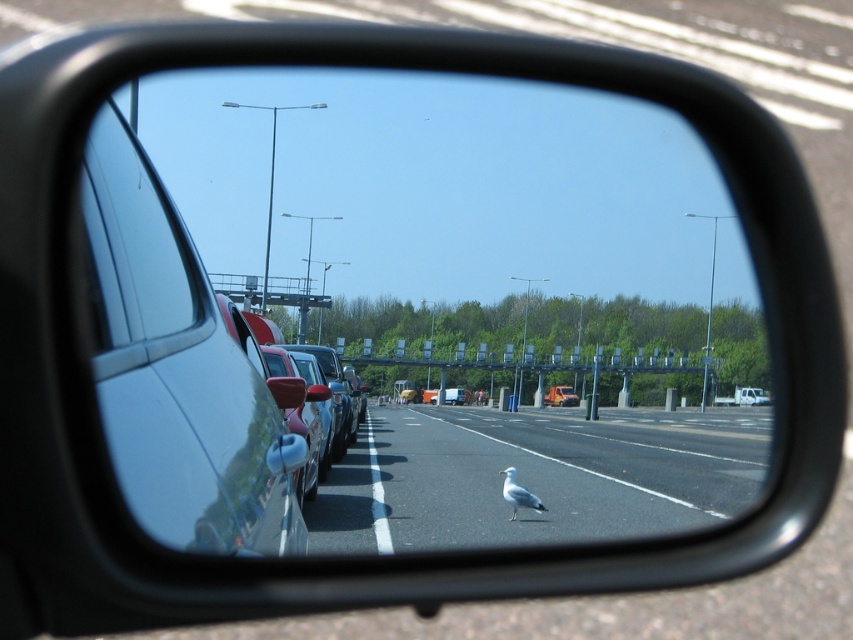
You are a driver checking your side mirror to see if you can safely change lanes. You notice two windows in the reflection of the side mirror. The glossy metallic car window at left and the clear glass car window at left. Which window is wider?

The glossy metallic car window at left is wider than the clear glass car window at left according to the description.

You are a passenger in a car and looking at the side mirror. You notice two windows on the left side of the mirror reflection. Which one is taller between the glossy metallic car window at left and the clear glass car window at left?

The glossy metallic car window at left is much taller than the clear glass car window at left according to the description.

You are driving and looking at the side mirror of your car. You see the smooth asphalt highway at center and the white matte bird at center. Which object appears taller in the reflection?

The smooth asphalt highway at center appears taller than the white matte bird at center in the reflection.